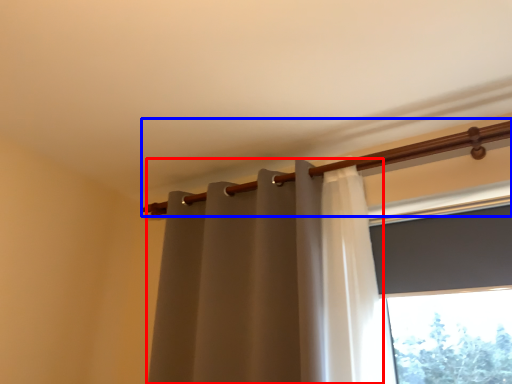
Question: Which object appears closest to the camera in this image, curtain (highlighted by a red box) or beam (highlighted by a blue box)?

Choices:
 (A) curtain
 (B) beam

Answer: (A)